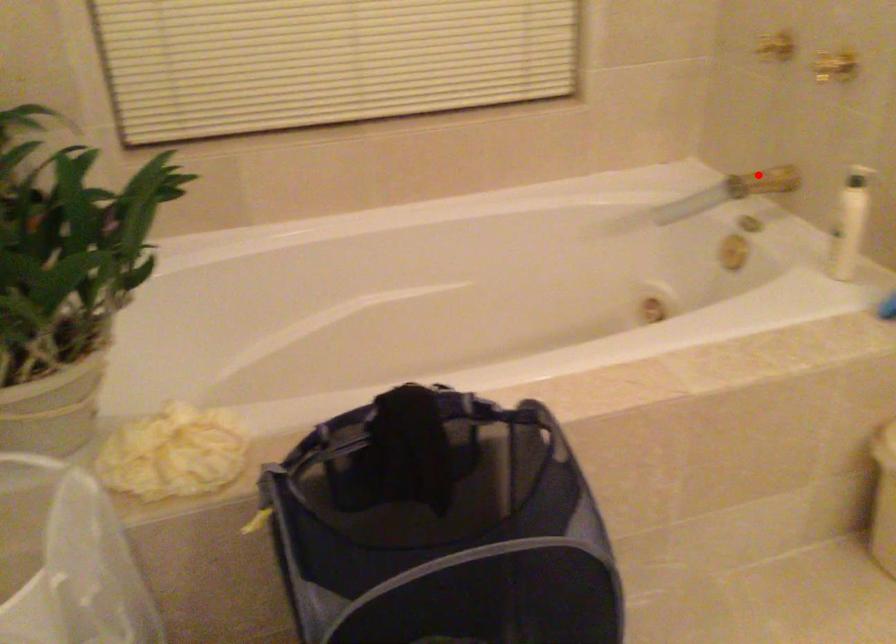
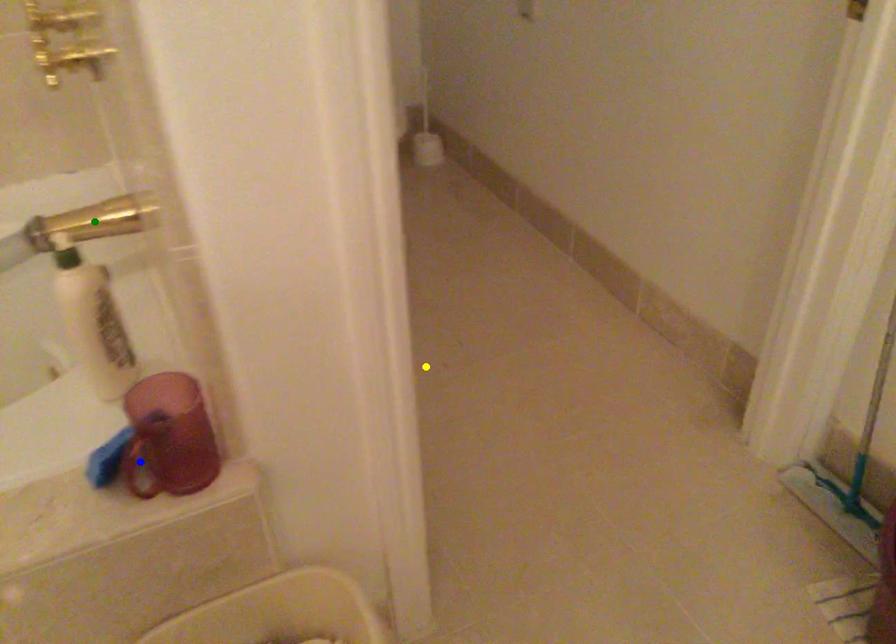
Question: I am providing you with two images of the same scene from different viewpoints. A red point is marked on the first image. You are given multiple points on the second image. Which mark in image 2 goes with the point in image 1?

Choices:
 (A) yellow point
 (B) blue point
 (C) green point

Answer: (C)